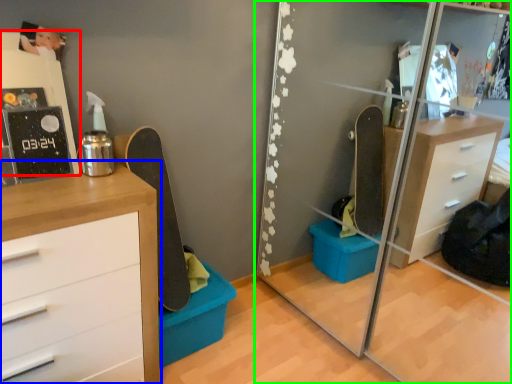
Question: Considering the real-world distances, which object is closest to shelf (highlighted by a red box)? chest of drawers (highlighted by a blue box) or mirror (highlighted by a green box).

Choices:
 (A) chest of drawers
 (B) mirror

Answer: (A)